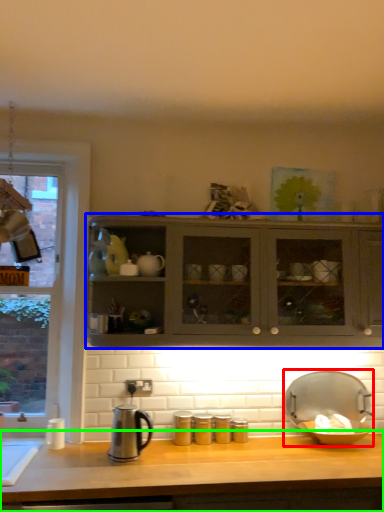
Question: Based on their relative distances, which object is farther from appliance (highlighted by a red box)? Choose from cabinetry (highlighted by a blue box) and countertop (highlighted by a green box).

Choices:
 (A) cabinetry
 (B) countertop

Answer: (A)